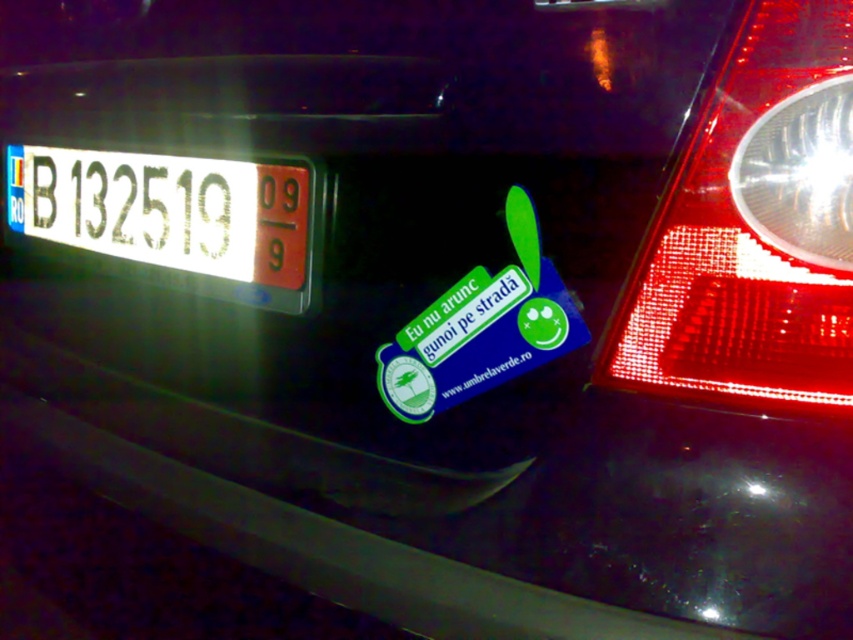
You are a pedestrian standing behind the car. You want to check if the license plate is visible from your position. The license plate is at the center of the car. Is the license plate blocked by the transparent plastic tail light at right at point (753, 228)?

The transparent plastic tail light at right at point (753, 228) is located to the right of the license plate. Since it is transparent, it does not block the license plate from being visible.